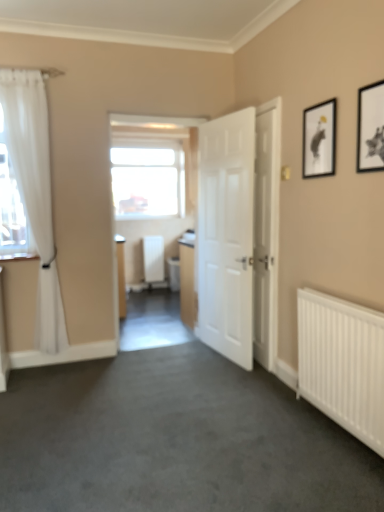
Question: Which is correct: black matte picture frame at upper right, which is the 1th picture frame in front-to-back order, is inside transparent glass window at center, or outside of it?

Choices:
 (A) inside
 (B) outside

Answer: (B)

Question: Is black matte picture frame at upper right, marked as the second picture frame in a left-to-right arrangement, taller or shorter than transparent glass window at center?

Choices:
 (A) short
 (B) tall

Answer: (A)

Question: Which object is the closest to the white matte radiator at center, positioned as the 1th radiator in back-to-front order?

Choices:
 (A) transparent glass window at center
 (B) black matte picture frame at upper right, arranged as the 2th picture frame when viewed from the right
 (C) white matte door at center, marked as the second door in a right-to-left arrangement
 (D) white metal radiator at lower right, the 2th radiator from the left
 (E) white sheer curtain at left

Answer: (A)

Question: Considering the real-world distances, which object is closest to the black matte picture frame at upper right, the second picture frame positioned from the back?

Choices:
 (A) white matte door at center, which is the first door from left to right
 (B) white matte radiator at center, positioned as the 1th radiator in back-to-front order
 (C) white metal radiator at lower right, marked as the 2th radiator in a back-to-front arrangement
 (D) white sheer curtain at left
 (E) black matte picture frame at upper right, arranged as the 2th picture frame when viewed from the right

Answer: (E)